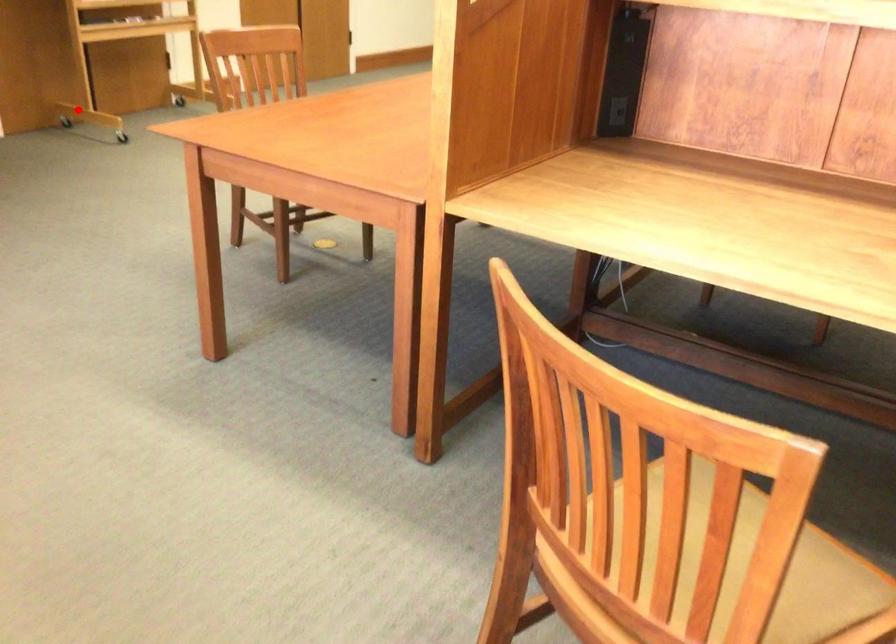
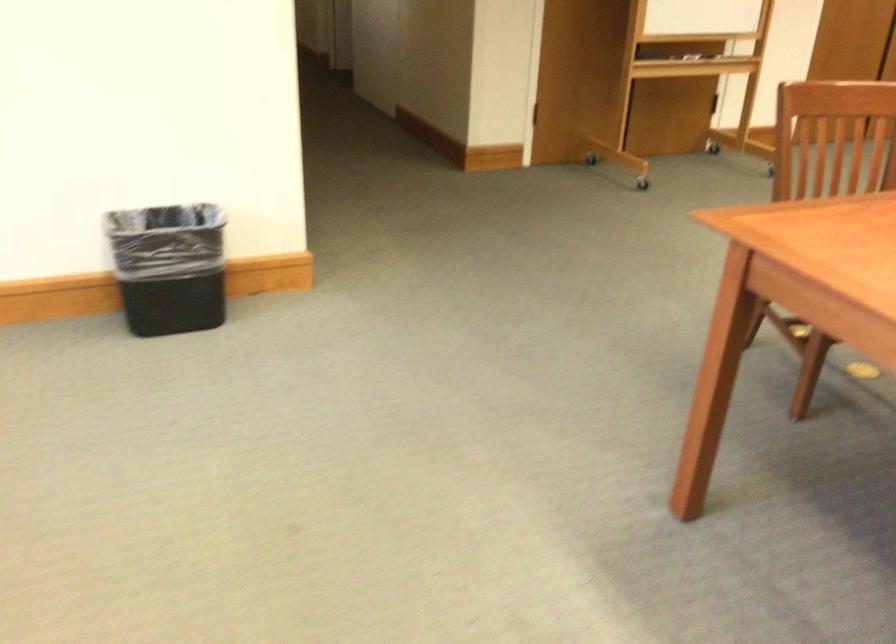
Find the pixel in the second image that matches the highlighted location in the first image.

(595, 153)